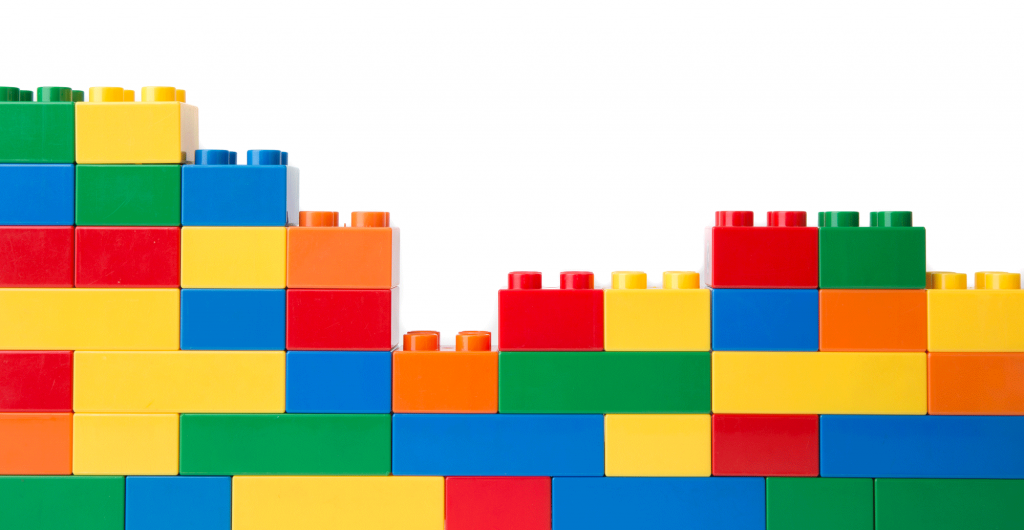
You are a GUI agent. You are given a task and a screenshot of the screen. Output one action in this format:
    pyautogui.click(x=<x>, y=<y>)
    Task: Click on the orange plastic building blocks
    This screenshot has height=530, width=1024.
    Given the screenshot: What is the action you would take?
    pyautogui.click(x=349, y=245), pyautogui.click(x=443, y=373), pyautogui.click(x=866, y=303), pyautogui.click(x=972, y=368)